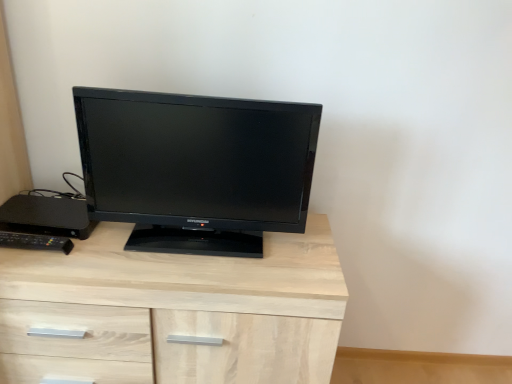
Image resolution: width=512 pixels, height=384 pixels. Identify the location of vacant area that lies in front of black plastic remote control at left, which is the first desktop from front to back. (23, 262).